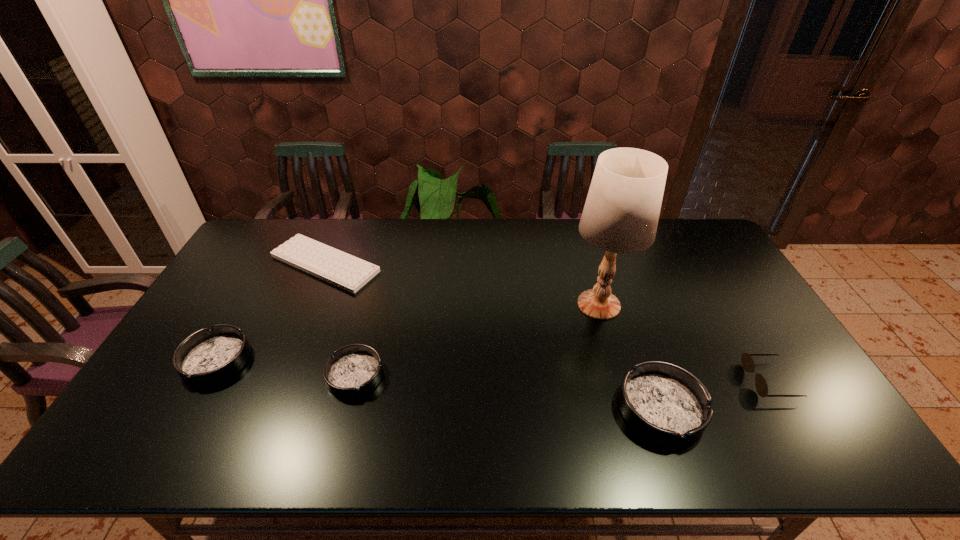
Find the location of a particular element. This screenshot has width=960, height=540. free point between the computer keyboard and the fifth tallest object is located at coordinates (340, 320).

Find the location of `free space between the shortest ashtray and the sunglasses`. free space between the shortest ashtray and the sunglasses is located at coordinates (562, 378).

The width and height of the screenshot is (960, 540). What are the coordinates of `unoccupied area between the rightmost ashtray and the rightmost object` in the screenshot? It's located at (715, 395).

Identify the location of vacant space that is in between the second shortest object and the rightmost ashtray. The image size is (960, 540). (508, 392).

Find the location of a particular element. This screenshot has height=540, width=960. free space between the computer keyboard and the leftmost ashtray is located at coordinates pos(271,312).

Identify the location of vacant space that is in between the lamp and the rightmost ashtray. (630, 356).

This screenshot has width=960, height=540. I want to click on vacant region between the second ashtray from right to left and the leftmost ashtray, so click(x=286, y=368).

Identify the location of object that is the fourth closest one to the rightmost ashtray. (348, 272).

Locate an element on the screen. The height and width of the screenshot is (540, 960). object that ranks as the second closest to the computer keyboard is located at coordinates (354, 370).

You are a GUI agent. You are given a task and a screenshot of the screen. Output one action in this format:
    pyautogui.click(x=<x>, y=<y>)
    Task: Click on the ashtray that can be found as the closest to the second shortest object
    The height and width of the screenshot is (540, 960).
    Given the screenshot: What is the action you would take?
    pyautogui.click(x=207, y=357)